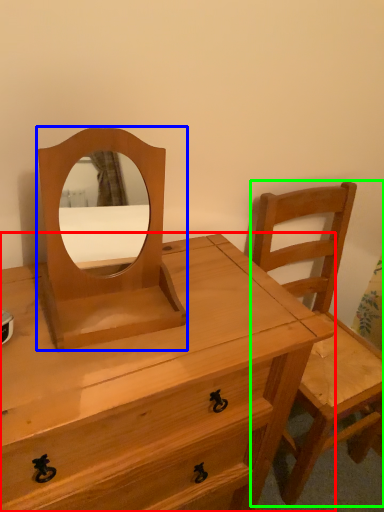
Question: Based on their relative distances, which object is farther from chest of drawers (highlighted by a red box)? Choose from mirror (highlighted by a blue box) and chair (highlighted by a green box).

Choices:
 (A) mirror
 (B) chair

Answer: (B)